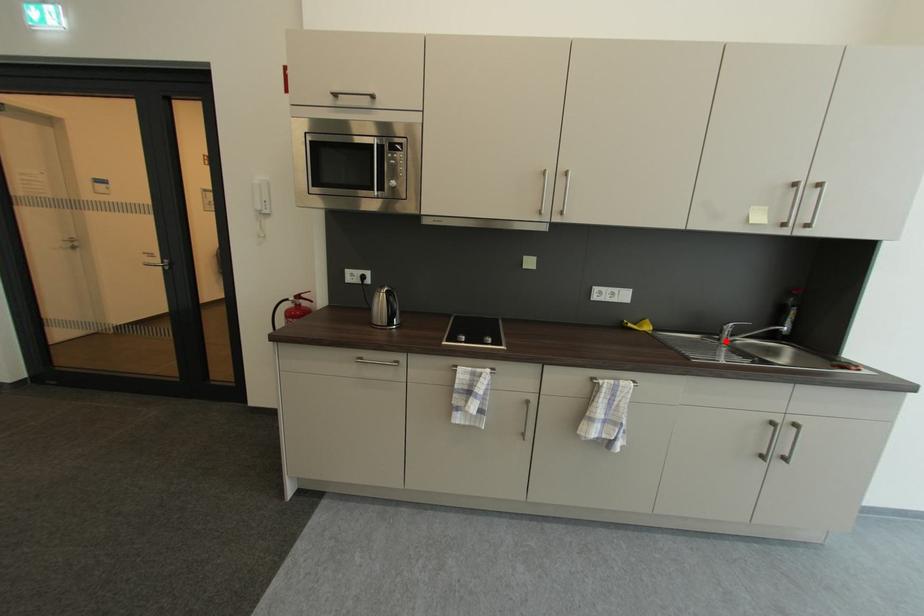
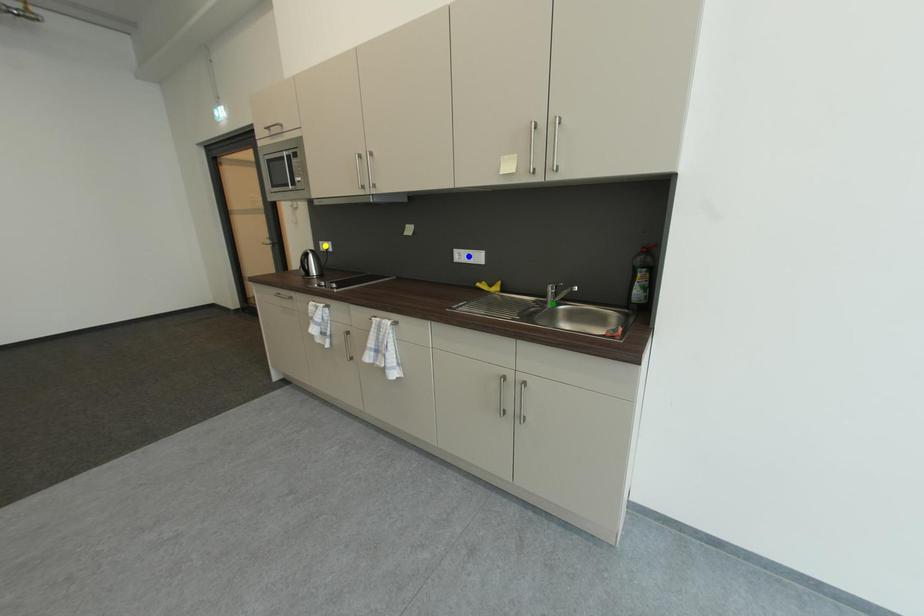
Question: I am providing you with two images of the same scene from different viewpoints. A red point is marked on the first image. You are given multiple points on the second image. Which point in image 2 represents the same 3d spot as the red point in image 1?

Choices:
 (A) green point
 (B) blue point
 (C) yellow point

Answer: (A)